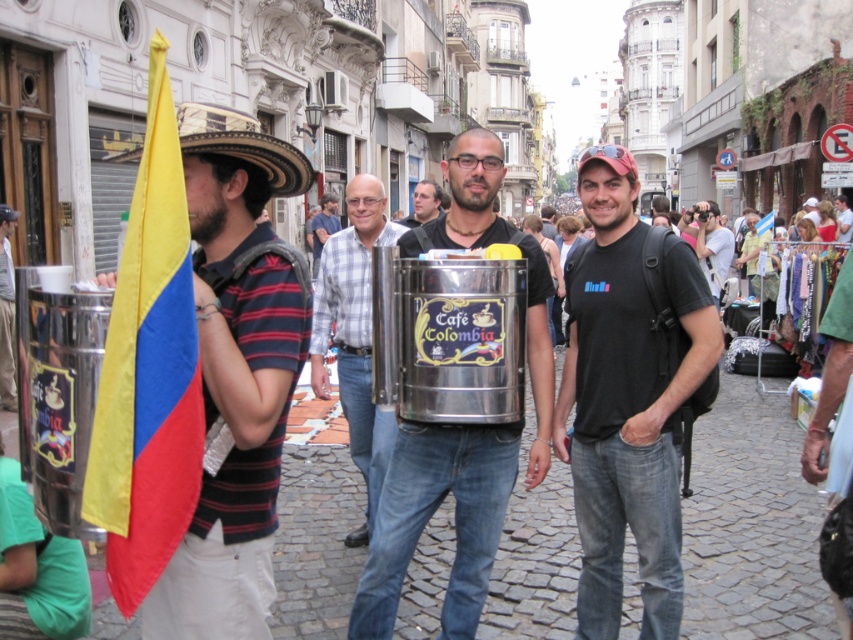
The width and height of the screenshot is (853, 640). What do you see at coordinates (431, 515) in the screenshot? I see `metallic silver container at center` at bounding box center [431, 515].

Does metallic silver container at center lie in front of matte black t-shirt at center?

Yes, metallic silver container at center is in front of matte black t-shirt at center.

Does point (474, 236) come closer to viewer compared to point (843, 204)?

Yes, it is.

The height and width of the screenshot is (640, 853). Identify the location of metallic silver container at center. (431, 515).

Can you confirm if matte black flag at left is positioned to the right of plaid shirt at center?

Correct, you'll find matte black flag at left to the right of plaid shirt at center.

Does matte black flag at left have a greater height compared to plaid shirt at center?

Yes.

At what (x,y) coordinates should I click in order to perform the action: click on matte black flag at left. Please return your answer as a coordinate pair (x, y). Looking at the image, I should click on (235, 372).

Is point (403, 515) less distant than point (0, 397)?

Yes, point (403, 515) is in front of point (0, 397).

Which is behind, point (517, 460) or point (7, 397)?

Point (7, 397)

The image size is (853, 640). I want to click on metallic silver container at center, so click(431, 515).